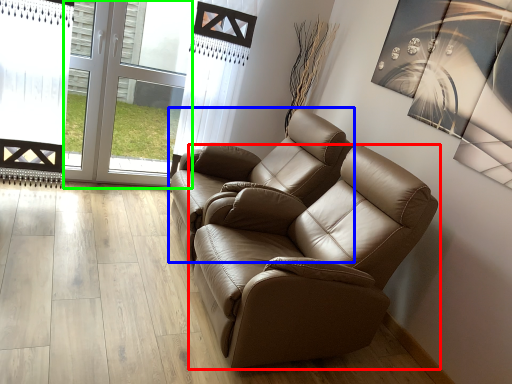
Question: Considering the real-world distances, which object is farthest from chair (highlighted by a red box)? chair (highlighted by a blue box) or glass door (highlighted by a green box)?

Choices:
 (A) chair
 (B) glass door

Answer: (B)